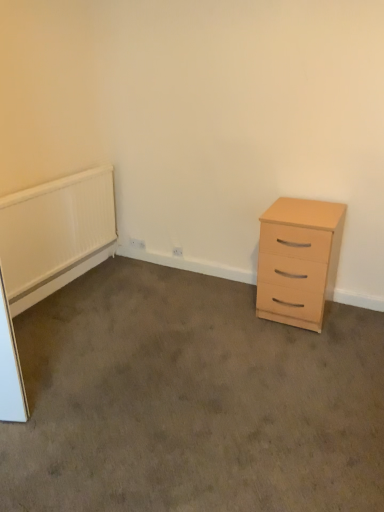
You are a GUI agent. You are given a task and a screenshot of the screen. Output one action in this format:
    pyautogui.click(x=<x>, y=<y>)
    Task: Click on the free region under white textured radiator at left (from a real-world perspective)
    
    Given the screenshot: What is the action you would take?
    pyautogui.click(x=77, y=279)